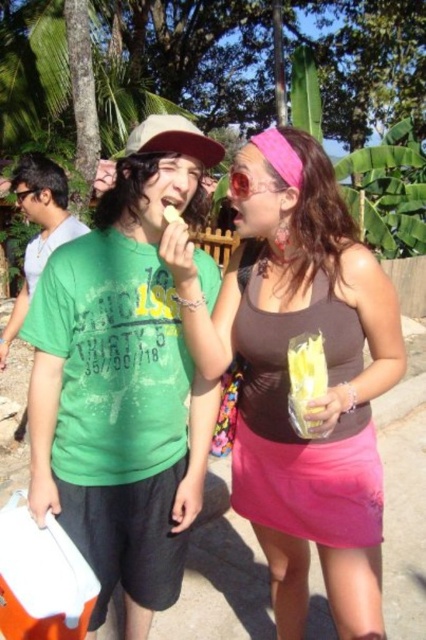
Does green matte shirt at center come behind yellow plastic bag of chips at center?

Yes.

Does green matte shirt at center come in front of yellow plastic bag of chips at center?

No, green matte shirt at center is further to the viewer.

Which is behind, point (149, 422) or point (288, 401)?

The point (149, 422) is behind.

This screenshot has height=640, width=426. I want to click on green matte shirt at center, so [123, 380].

Can you confirm if green matte t-shirt at left is bigger than yellow plastic bag of chips at center?

Yes, green matte t-shirt at left is bigger than yellow plastic bag of chips at center.

Is green matte t-shirt at left to the left of yellow plastic bag of chips at center from the viewer's perspective?

Correct, you'll find green matte t-shirt at left to the left of yellow plastic bag of chips at center.

Does point (5, 346) come closer to viewer compared to point (313, 429)?

No, it is behind (313, 429).

Where is `green matte t-shirt at left`? The image size is (426, 640). green matte t-shirt at left is located at coordinates (40, 228).

Does pink fabric skirt at center appear over matte skin at mouth center?

No.

Does pink fabric skirt at center have a smaller size compared to matte skin at mouth center?

Yes, pink fabric skirt at center is smaller than matte skin at mouth center.

Find the location of a particular element. pink fabric skirt at center is located at coordinates (288, 384).